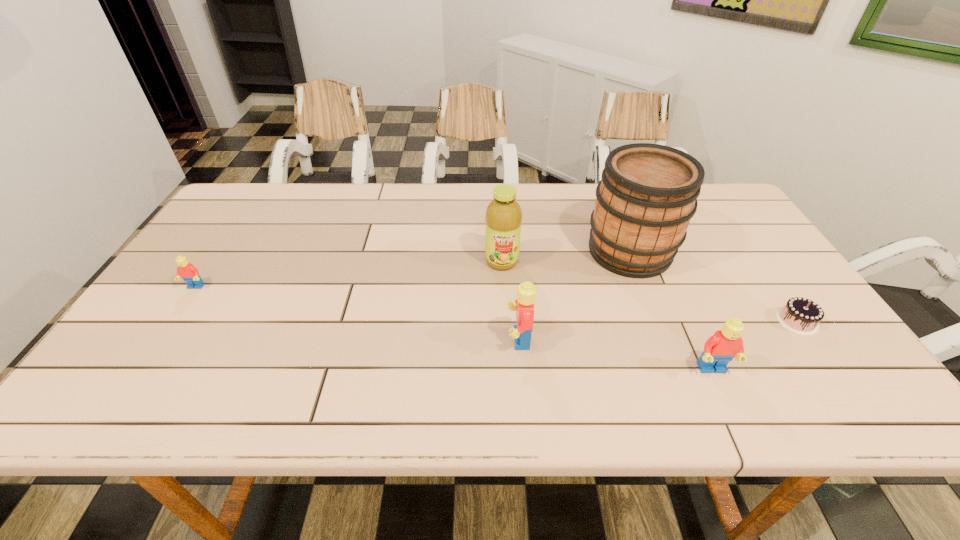
This screenshot has height=540, width=960. In order to click on vacant spot for a new Lego to ensure equal spacing in this screenshot , I will do tap(348, 312).